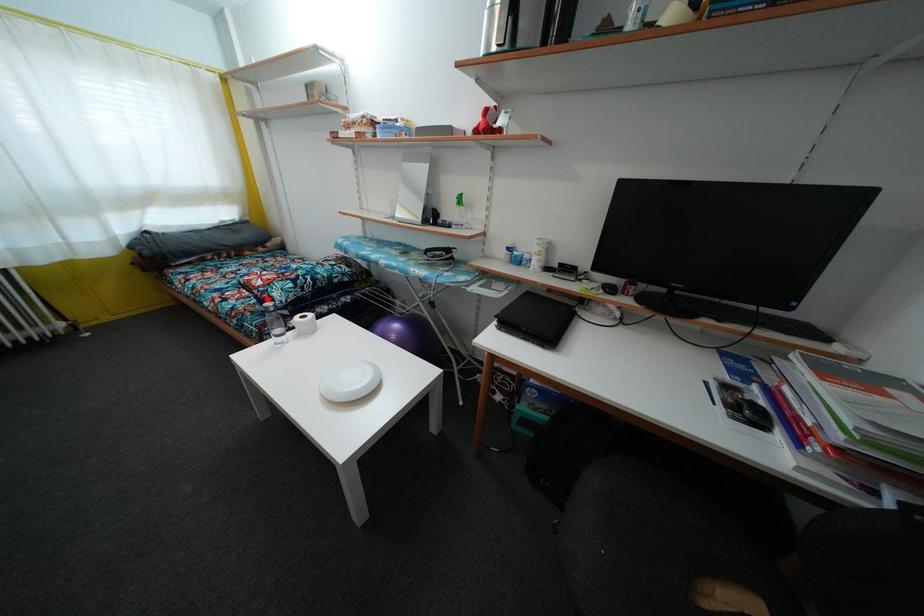
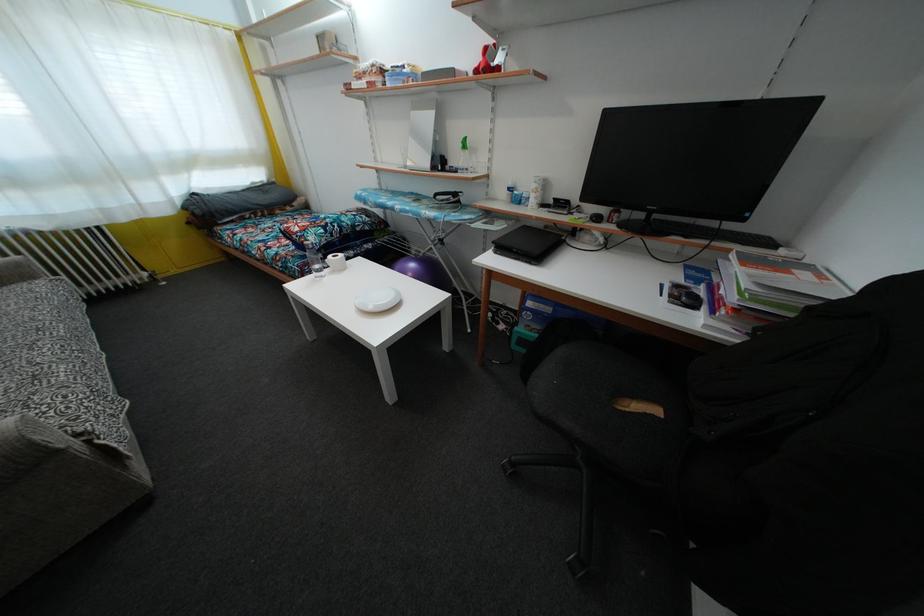
In the second image, find the point that corresponds to the highlighted location in the first image.

(305, 244)